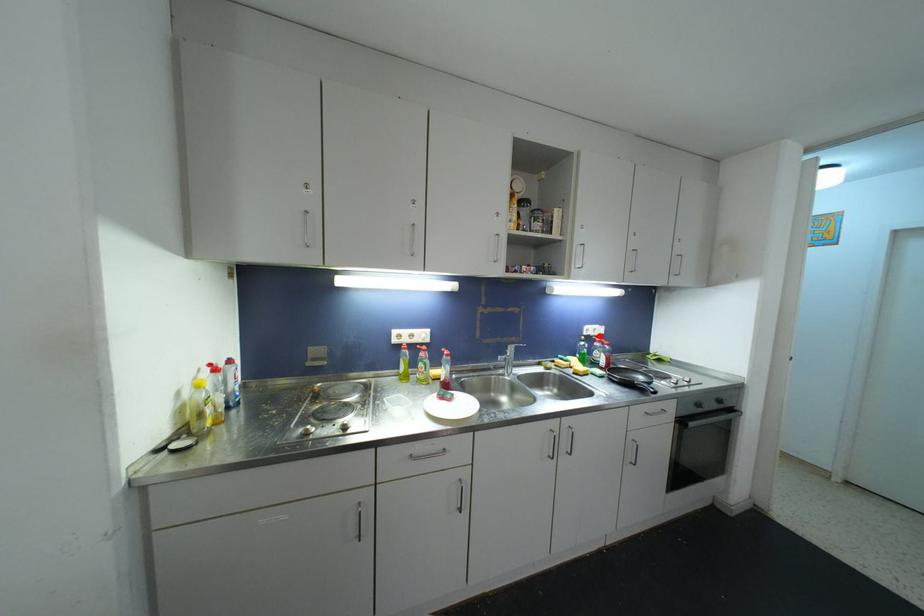
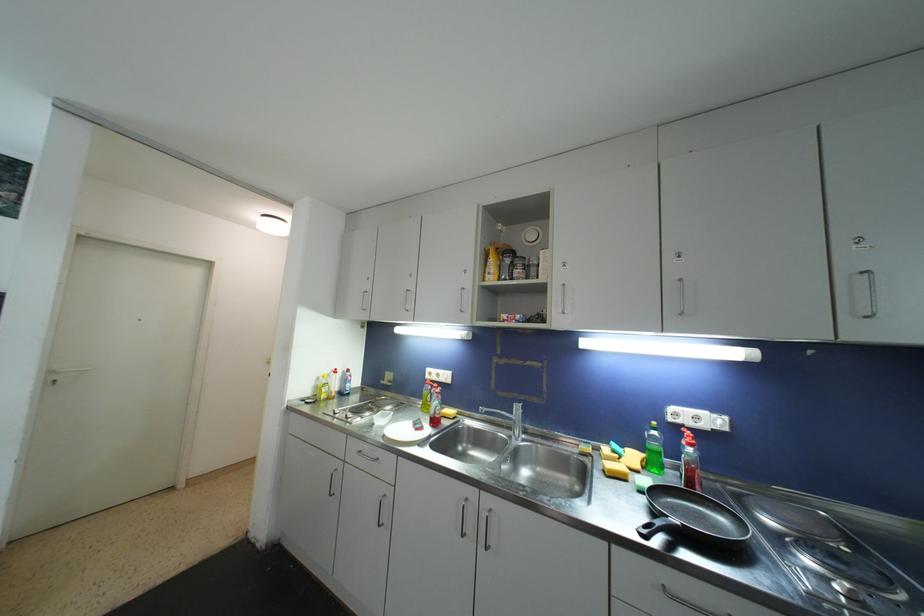
The point at the highlighted location is marked in the first image. Where is the corresponding point in the second image?

(708, 429)